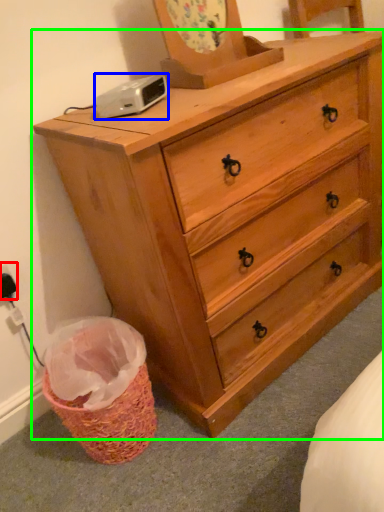
Question: Considering the real-world distances, which object is farthest from electric outlet (highlighted by a red box)? gadget (highlighted by a blue box) or chest of drawers (highlighted by a green box)?

Choices:
 (A) gadget
 (B) chest of drawers

Answer: (B)